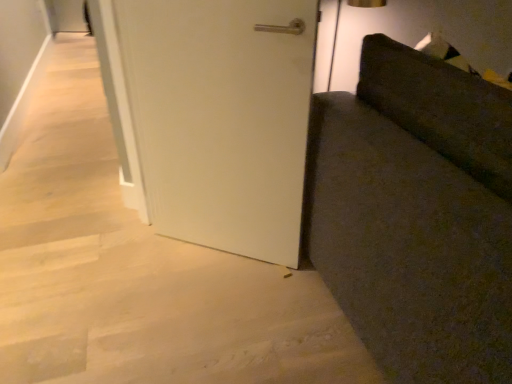
Find the location of a particular element. This screenshot has width=512, height=384. white matte door at center is located at coordinates (222, 118).

Image resolution: width=512 pixels, height=384 pixels. Describe the element at coordinates (222, 118) in the screenshot. I see `white matte door at center` at that location.

Where is `dark fabric couch at right`? This screenshot has height=384, width=512. dark fabric couch at right is located at coordinates (418, 215).

The width and height of the screenshot is (512, 384). What do you see at coordinates (418, 215) in the screenshot?
I see `dark fabric couch at right` at bounding box center [418, 215].

Where is `white matte door at center`? This screenshot has height=384, width=512. white matte door at center is located at coordinates (222, 118).

Is white matte door at center at the right side of dark fabric couch at right?

In fact, white matte door at center is to the left of dark fabric couch at right.

Consider the image. Is the depth of white matte door at center greater than that of dark fabric couch at right?

Yes, white matte door at center is further from the camera.

Considering the positions of point (167, 214) and point (448, 156), is point (167, 214) closer or farther from the camera than point (448, 156)?

Point (167, 214) is farther from the camera than point (448, 156).

From the image's perspective, which object appears higher, white matte door at center or dark fabric couch at right?

white matte door at center is shown above in the image.

From a real-world perspective, is white matte door at center over dark fabric couch at right?

Correct, in the physical world, white matte door at center is higher than dark fabric couch at right.

Considering the sizes of objects white matte door at center and dark fabric couch at right in the image provided, who is wider, white matte door at center or dark fabric couch at right?

dark fabric couch at right is wider.

Considering the sizes of objects white matte door at center and dark fabric couch at right in the image provided, who is shorter, white matte door at center or dark fabric couch at right?

dark fabric couch at right.

Which of these two, white matte door at center or dark fabric couch at right, is smaller?

Smaller between the two is white matte door at center.

Choose the correct answer: Is white matte door at center inside dark fabric couch at right or outside it?

white matte door at center is outside dark fabric couch at right.

Is white matte door at center not close to dark fabric couch at right?

No.

Is white matte door at center oriented towards dark fabric couch at right?

No, white matte door at center is not turned towards dark fabric couch at right.

Locate an element on the screen. The image size is (512, 384). furniture that appears below the white matte door at center (from the image's perspective) is located at coordinates (418, 215).

In the scene shown: Considering the positions of objects dark fabric couch at right and white matte door at center in the image provided, who is more to the left, dark fabric couch at right or white matte door at center?

white matte door at center is more to the left.

In the image, is dark fabric couch at right positioned in front of or behind white matte door at center?

dark fabric couch at right is positioned closer to the viewer than white matte door at center.

Considering the positions of point (445, 83) and point (140, 42), is point (445, 83) closer or farther from the camera than point (140, 42)?

Clearly, point (445, 83) is closer to the camera than point (140, 42).

From the image's perspective, does dark fabric couch at right appear higher than white matte door at center?

No.

From a real-world perspective, which object rests below the other?

dark fabric couch at right.

Considering the sizes of objects dark fabric couch at right and white matte door at center in the image provided, who is wider, dark fabric couch at right or white matte door at center?

With larger width is dark fabric couch at right.

Can you confirm if dark fabric couch at right is shorter than white matte door at center?

Yes, dark fabric couch at right is shorter than white matte door at center.

Does dark fabric couch at right have a larger size compared to white matte door at center?

Indeed, dark fabric couch at right has a larger size compared to white matte door at center.

Is dark fabric couch at right located outside white matte door at center?

Absolutely, dark fabric couch at right is external to white matte door at center.

Is dark fabric couch at right next to white matte door at center and touching it?

No, dark fabric couch at right is not touching white matte door at center.

Is dark fabric couch at right looking in the opposite direction of white matte door at center?

Absolutely, dark fabric couch at right is directed away from white matte door at center.

How different are the orientations of dark fabric couch at right and white matte door at center in degrees?

130 degrees separate the facing orientations of dark fabric couch at right and white matte door at center.

How distant is dark fabric couch at right from white matte door at center?

dark fabric couch at right and white matte door at center are 42.09 centimeters apart.

Locate an element on the screen. This screenshot has width=512, height=384. furniture below the white matte door at center (from a real-world perspective) is located at coordinates (418, 215).

Image resolution: width=512 pixels, height=384 pixels. There is a dark fabric couch at right. Find the location of `door above it (from a real-world perspective)`. door above it (from a real-world perspective) is located at coordinates (222, 118).

Where is `door behind the dark fabric couch at right`? Image resolution: width=512 pixels, height=384 pixels. door behind the dark fabric couch at right is located at coordinates point(222,118).